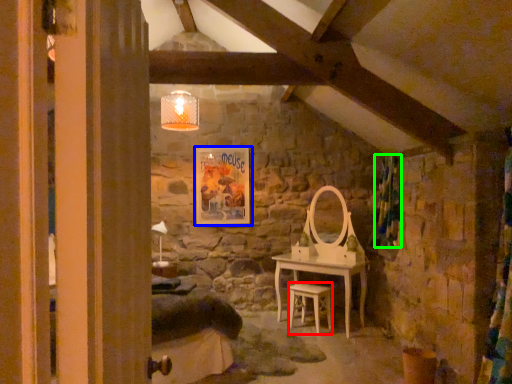
Question: Which object is positioned closest to chair (highlighted by a red box)? Select from picture frame (highlighted by a blue box) and curtain (highlighted by a green box).

Choices:
 (A) picture frame
 (B) curtain

Answer: (B)